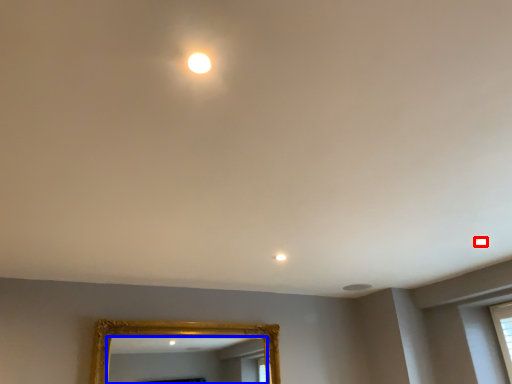
Question: Among these objects, which one is farthest to the camera, light (highlighted by a red box) or mirror (highlighted by a blue box)?

Choices:
 (A) light
 (B) mirror

Answer: (B)